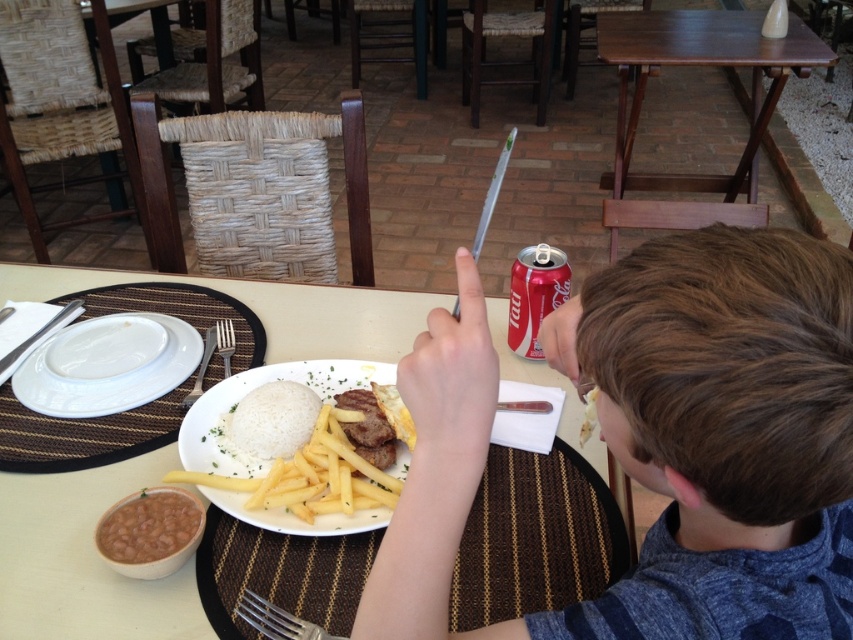
You are a food delivery person who needs to place a hot dish on the table without touching the existing items. The plate you are placing is 10 inches in diameter. Can you safely place it on the table near the white ceramic plate at center?

The white ceramic plate at center is 28.92 inches from viewer, so the distance between the new plate and the existing plate is sufficient to place the 10 inch diameter plate safely without touching.

You are a waiter at the restaurant and need to place a new drink order on the table. The drink must be placed between the brown hair at upper right and the silver metallic fork at lower center. Can you fit the drink there?

The brown hair at upper right is much taller than the silver metallic fork at lower center, so there is enough vertical space to place the drink between them.

You are a food critic evaluating portion sizes. You have a ruler and need to compare the width of the white ceramic plate at center and the yellow fried french fries at center. Which one is wider?

The white ceramic plate at center is wider than the yellow fried french fries at center according to the description.